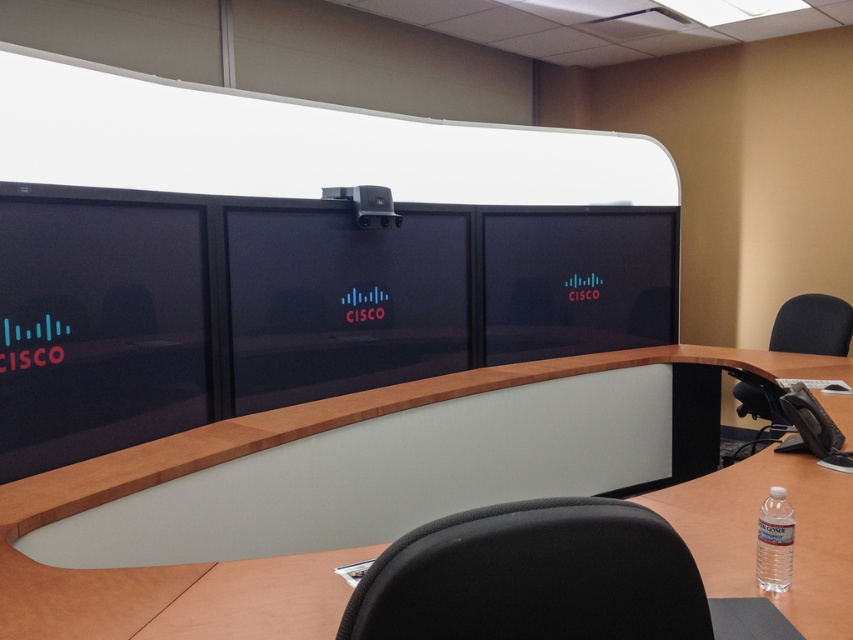
Which of these two, light brown wood table at center or clear plastic bottle at lower right, stands shorter?

clear plastic bottle at lower right

Does light brown wood table at center appear on the left side of clear plastic bottle at lower right?

Yes, light brown wood table at center is to the left of clear plastic bottle at lower right.

Where is `light brown wood table at center`? The image size is (853, 640). light brown wood table at center is located at coordinates (254, 560).

Is point (654, 508) closer to viewer compared to point (173, 397)?

Yes, it is in front of point (173, 397).

This screenshot has width=853, height=640. What do you see at coordinates (254, 560) in the screenshot?
I see `light brown wood table at center` at bounding box center [254, 560].

Identify the location of light brown wood table at center. The width and height of the screenshot is (853, 640). (254, 560).

Is point (9, 362) in front of point (589, 234)?

Yes, it is.

Can you confirm if matte black monitor at left is bigger than matte black monitor at center?

Actually, matte black monitor at left might be smaller than matte black monitor at center.

Between point (122, 266) and point (520, 262), which one is positioned in front?

Point (122, 266) is in front.

Where is `matte black monitor at left`? matte black monitor at left is located at coordinates [97, 326].